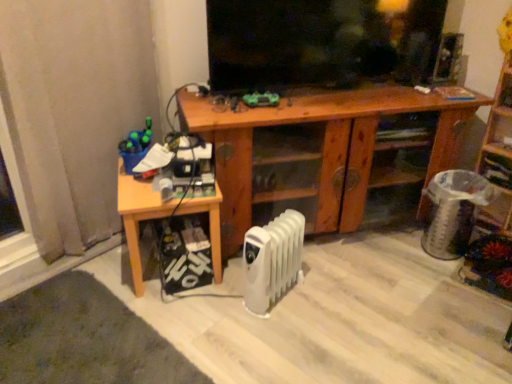
Question: Is green matte toy at center, which appears as the 1th toy when viewed from the right, at the right side of wooden bookshelf at right?

Choices:
 (A) no
 (B) yes

Answer: (A)

Question: Is green matte toy at center, placed as the first toy when sorted from top to bottom, thinner than wooden bookshelf at right?

Choices:
 (A) yes
 (B) no

Answer: (A)

Question: From the image's perspective, does green matte toy at center, which appears as the 1th toy when viewed from the right, appear higher than wooden bookshelf at right?

Choices:
 (A) no
 (B) yes

Answer: (B)

Question: Is green matte toy at center, placed as the first toy when sorted from top to bottom, closer to the viewer compared to wooden bookshelf at right?

Choices:
 (A) no
 (B) yes

Answer: (A)

Question: From the image's perspective, is green matte toy at center, the 2th toy ordered from the bottom, below wooden bookshelf at right?

Choices:
 (A) yes
 (B) no

Answer: (B)

Question: Considering the relative sizes of green matte toy at center, which appears as the 1th toy when viewed from the right, and wooden bookshelf at right in the image provided, is green matte toy at center, which appears as the 1th toy when viewed from the right, smaller than wooden bookshelf at right?

Choices:
 (A) yes
 (B) no

Answer: (A)

Question: Does light wood table at lower left have a larger size compared to green matte toy at center, placed as the second toy when sorted from left to right?

Choices:
 (A) no
 (B) yes

Answer: (B)

Question: From a real-world perspective, is light wood table at lower left under green matte toy at center, placed as the second toy when sorted from left to right?

Choices:
 (A) yes
 (B) no

Answer: (A)

Question: Is green matte toy at center, which appears as the 1th toy when viewed from the right, completely or partially inside light wood table at lower left?

Choices:
 (A) no
 (B) yes

Answer: (A)

Question: Considering the relative sizes of light wood table at lower left and green matte toy at center, which appears as the 1th toy when viewed from the right, in the image provided, is light wood table at lower left shorter than green matte toy at center, which appears as the 1th toy when viewed from the right,?

Choices:
 (A) yes
 (B) no

Answer: (B)

Question: Would you say light wood table at lower left is a long distance from green matte toy at center, placed as the second toy when sorted from left to right?

Choices:
 (A) yes
 (B) no

Answer: (B)

Question: Is light wood table at lower left thinner than green matte toy at center, placed as the first toy when sorted from top to bottom?

Choices:
 (A) no
 (B) yes

Answer: (A)

Question: From the image's perspective, would you say wooden bookshelf at right is positioned over wooden cabinet at center?

Choices:
 (A) no
 (B) yes

Answer: (B)